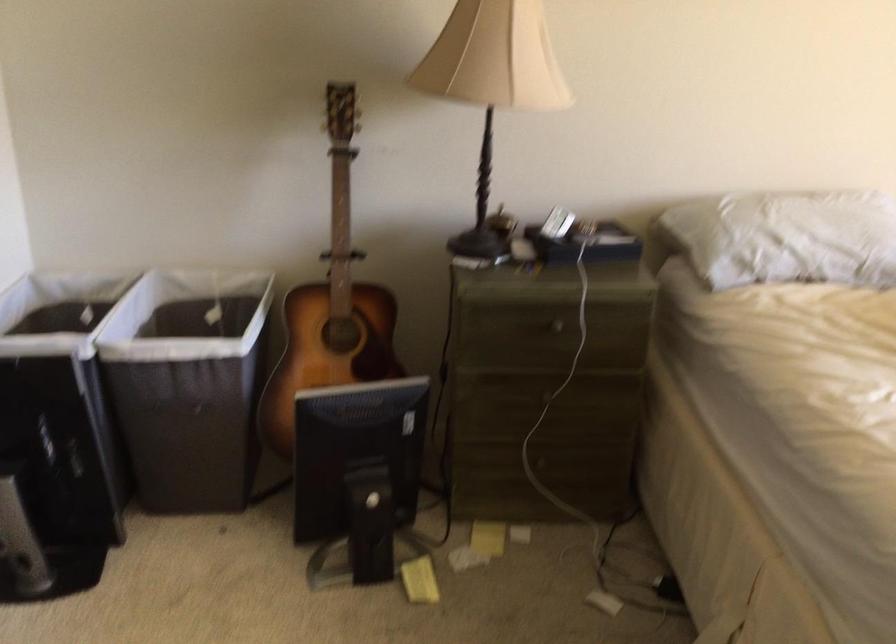
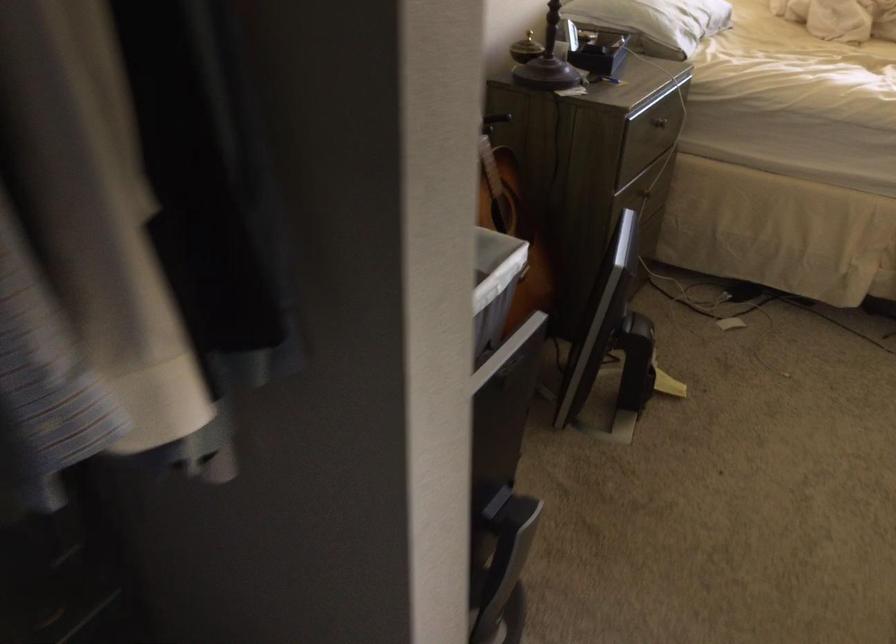
Question: I am providing you with two images of the same scene from different viewpoints. Which of the following objects are not visible in image2?

Choices:
 (A) drawer handle
 (B) acoustic guitar
 (C) pen holder cup
 (D) white hamper

Answer: (A)